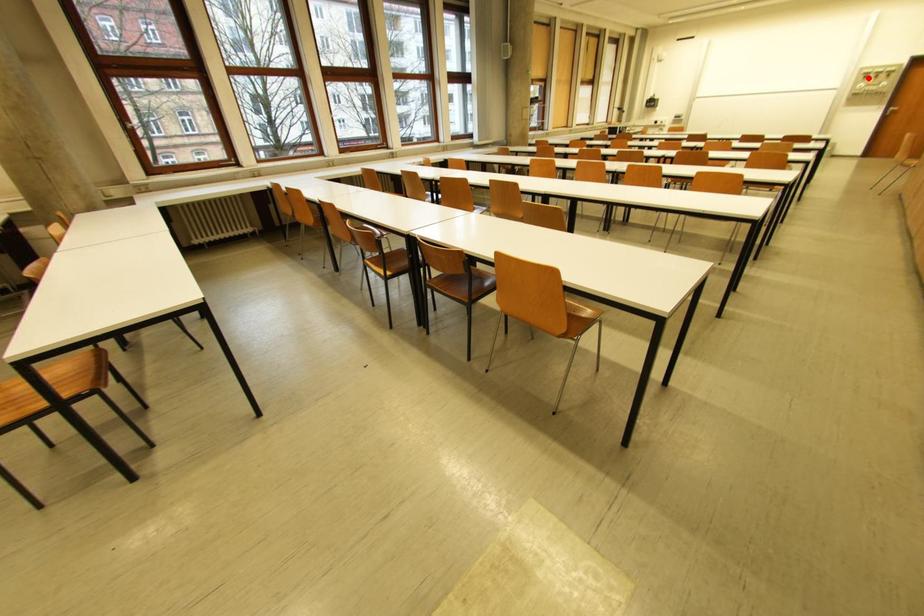
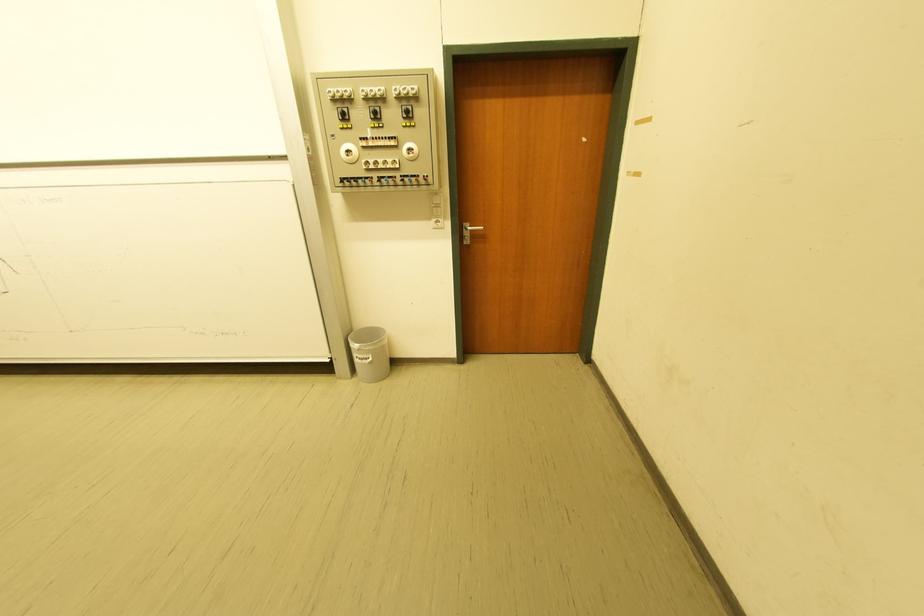
Question: I am providing you with two images of the same scene from different viewpoints. Given a red point in image1, look at the same physical point in image2. Is it:

Choices:
 (A) Closer to the viewpoint
 (B) Farther from the viewpoint

Answer: (A)